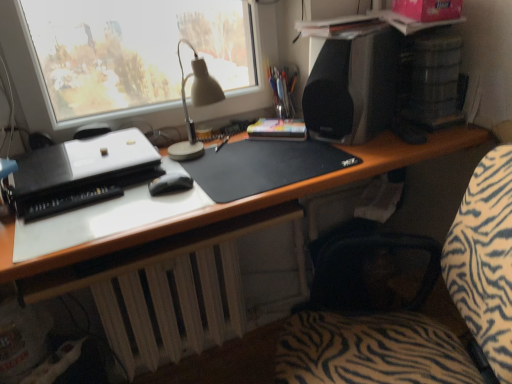
Identify the location of free space above black matte mousepad at center (from a real-world perspective). This screenshot has width=512, height=384. (264, 155).